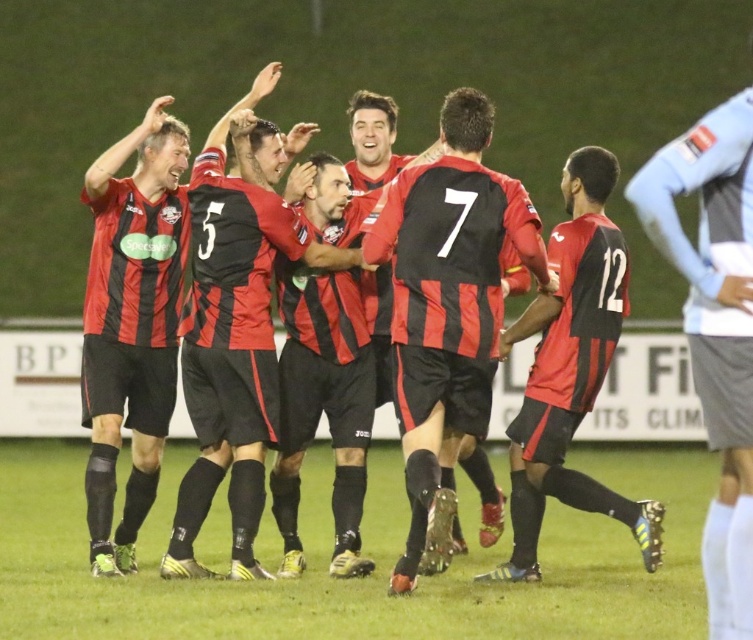
Does light blue jersey at upper right appear on the right side of matte black jersey at center?

Yes, light blue jersey at upper right is to the right of matte black jersey at center.

Can you confirm if light blue jersey at upper right is positioned to the left of matte black jersey at center?

No, light blue jersey at upper right is not to the left of matte black jersey at center.

Is point (709, 339) positioned in front of point (610, 304)?

Yes, point (709, 339) is in front of point (610, 304).

Identify the location of light blue jersey at upper right. (715, 326).

Is matte red and black jersey at center above matte black jersey at center?

Correct, matte red and black jersey at center is located above matte black jersey at center.

Between point (407, 342) and point (520, 516), which one is positioned in front?

Point (407, 342) is in front.

At what (x,y) coordinates should I click in order to perform the action: click on matte red and black jersey at center. Please return your answer as a coordinate pair (x, y). The image size is (753, 640). Looking at the image, I should click on [447, 308].

Does point (479, 257) lie in front of point (741, 563)?

No, it is not.

Is point (401, 301) positioned behind point (718, 308)?

Yes, point (401, 301) is behind point (718, 308).

In order to click on matte red and black jersey at center in this screenshot , I will do `click(447, 308)`.